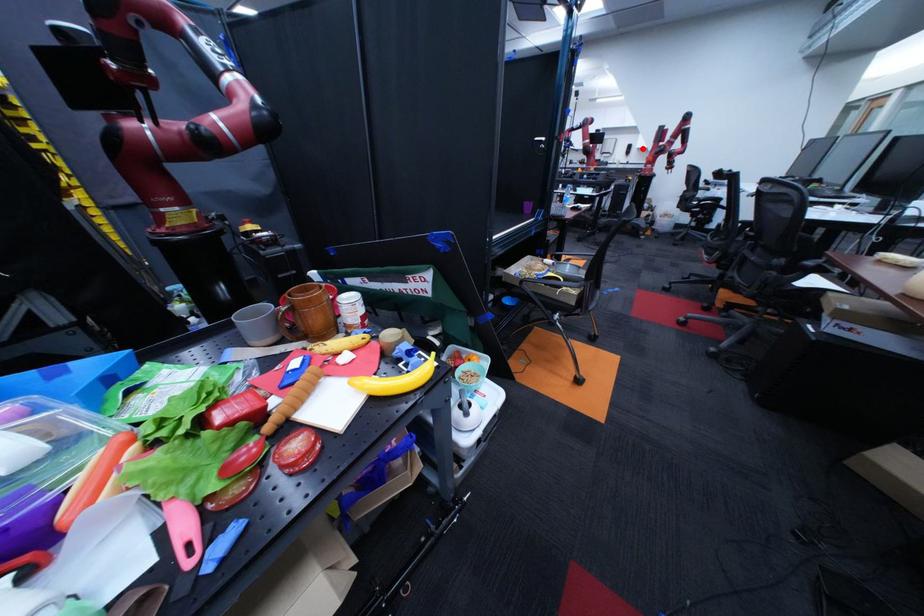
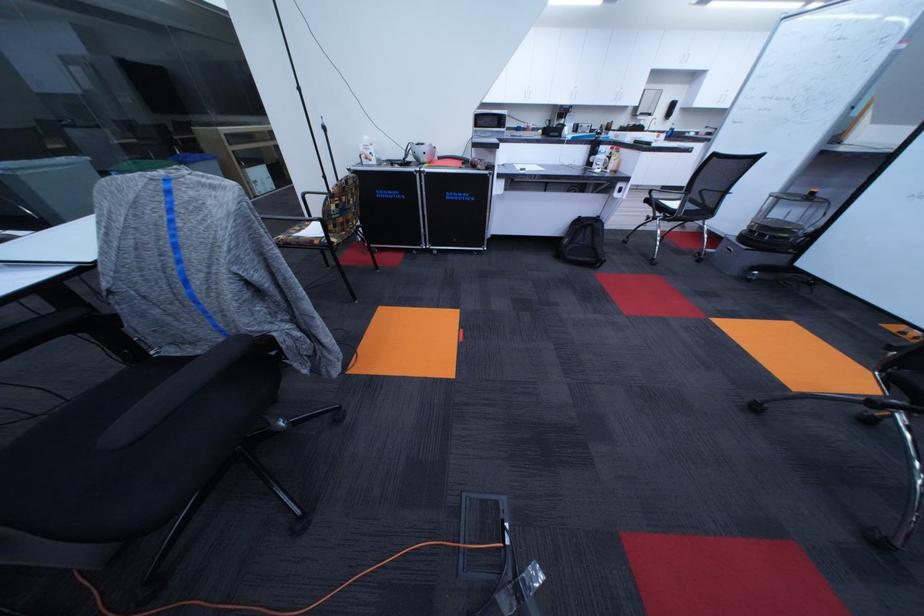
The point at the highlighted location is marked in the first image. Where is the corresponding point in the second image?

(686, 107)